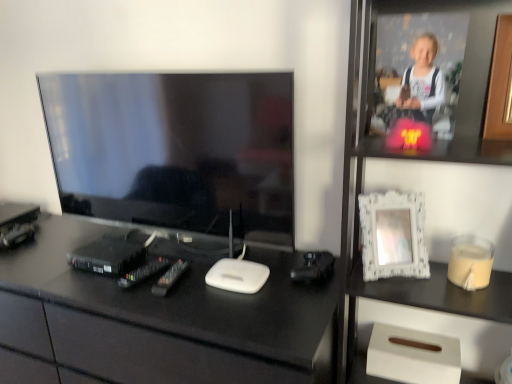
I want to click on blank space above black glossy desk at center (from a real-world perspective), so click(143, 259).